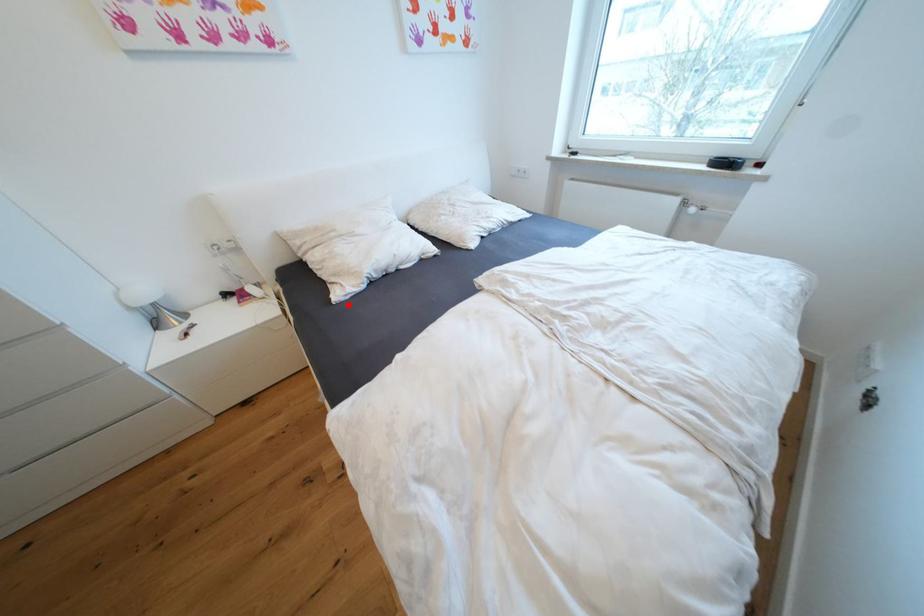
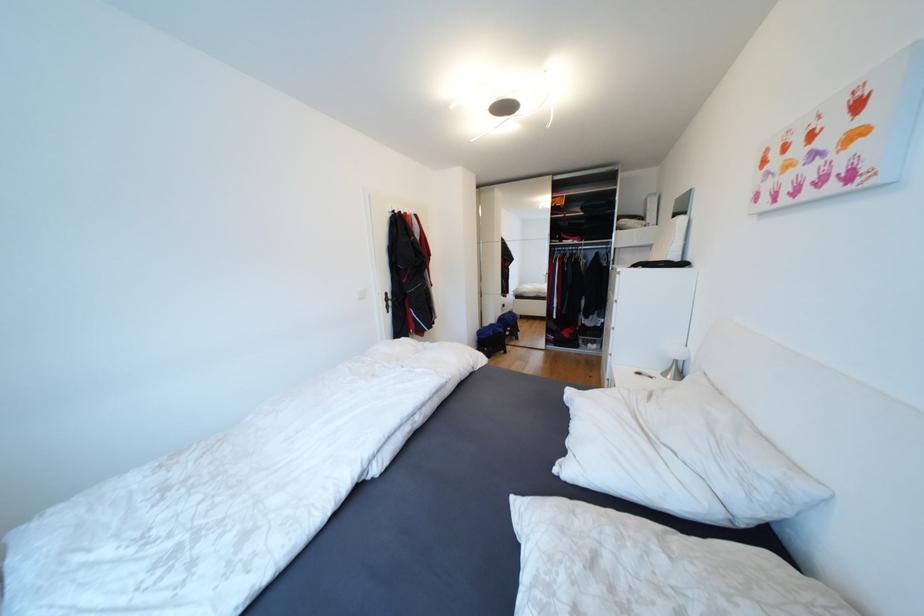
Question: I am providing you with two images of the same scene from different viewpoints. In image1, a red point is highlighted. Considering the same 3D point in image2, which of the following is correct?

Choices:
 (A) It is closer
 (B) It is farther

Answer: (A)